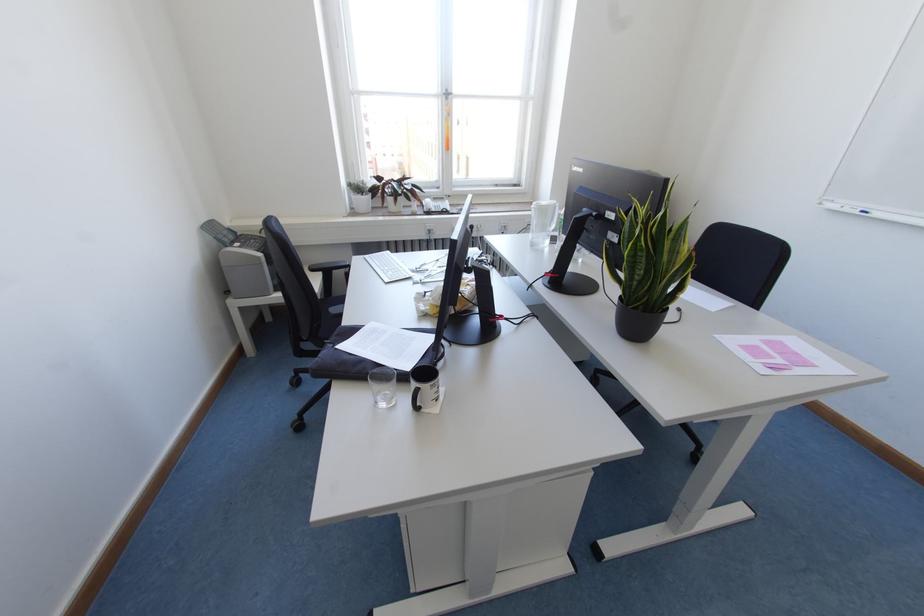
Find the location of a particular element. window handle is located at coordinates (447, 95).